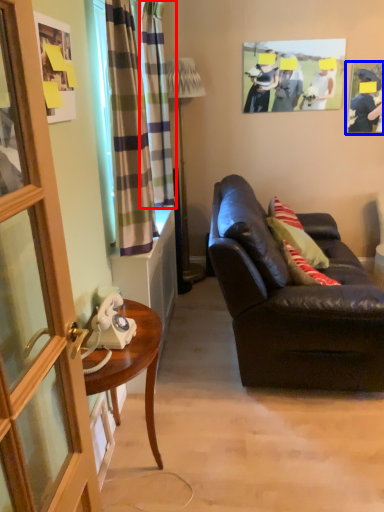
Question: Among these objects, which one is nearest to the camera, curtain (highlighted by a red box) or picture frame (highlighted by a blue box)?

Choices:
 (A) curtain
 (B) picture frame

Answer: (A)